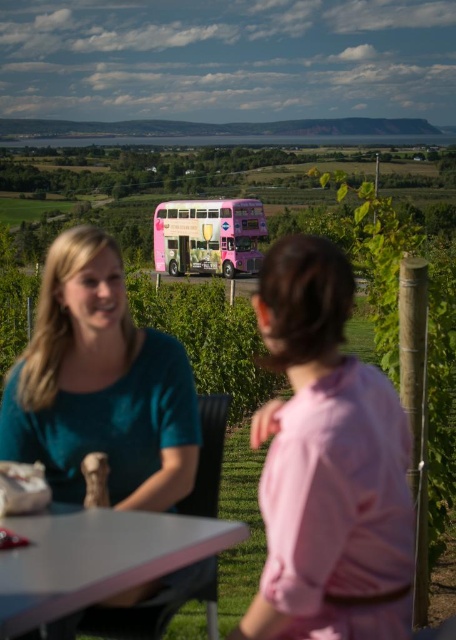
Question: Which object is the closest to the pink glossy double-decker bus at center?

Choices:
 (A) white matte table at lower center
 (B) pink fabric shirt at center
 (C) teal fabric shirt at center

Answer: (B)

Question: Which is nearer to the teal fabric shirt at center?

Choices:
 (A) white matte table at lower center
 (B) pink glossy double-decker bus at center

Answer: (A)

Question: Does pink fabric shirt at center have a smaller size compared to white matte table at lower center?

Choices:
 (A) yes
 (B) no

Answer: (B)

Question: Estimate the real-world distances between objects in this image. Which object is farther from the pink fabric shirt at center?

Choices:
 (A) pink glossy double-decker bus at center
 (B) white matte table at lower center

Answer: (A)

Question: Can you confirm if pink fabric shirt at center is bigger than white matte table at lower center?

Choices:
 (A) yes
 (B) no

Answer: (A)

Question: Is teal fabric shirt at center above pink glossy double-decker bus at center?

Choices:
 (A) yes
 (B) no

Answer: (B)